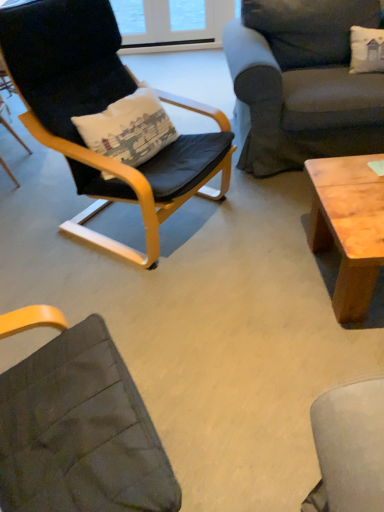
Question: In the image, is matte black chair at left, which ranks as the first chair in left-to-right order, on the left side or the right side of black leather chair at left, the first chair when ordered from right to left?

Choices:
 (A) left
 (B) right

Answer: (A)

Question: From a real-world perspective, is matte black chair at left, which ranks as the first chair in left-to-right order, above or below black leather chair at left, which is the second chair from left to right?

Choices:
 (A) above
 (B) below

Answer: (B)

Question: Which object is positioned farthest from the dark gray fabric couch at upper right?

Choices:
 (A) black leather chair at left, the first chair when ordered from right to left
 (B) matte black chair at left, which ranks as the first chair in left-to-right order
 (C) natural wood coffee table at right

Answer: (B)

Question: Which object is the closest to the dark gray fabric couch at upper right?

Choices:
 (A) black leather chair at left, the first chair when ordered from right to left
 (B) matte black chair at left, placed as the second chair when sorted from right to left
 (C) natural wood coffee table at right

Answer: (A)